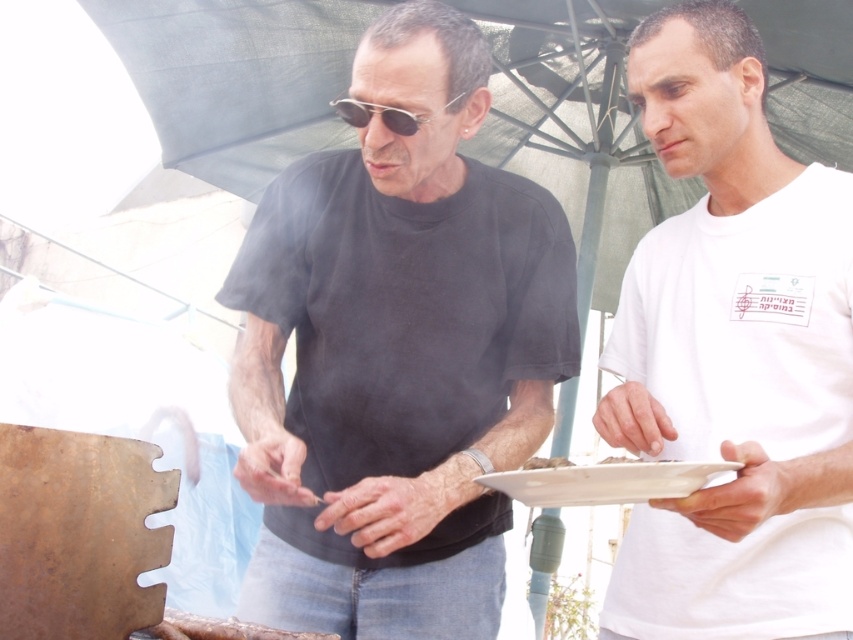
Question: Is white cotton t-shirt at center further to camera compared to sunglasses at center?

Choices:
 (A) no
 (B) yes

Answer: (A)

Question: Does black matte shirt at center appear on the right side of white cotton t-shirt at center?

Choices:
 (A) no
 (B) yes

Answer: (A)

Question: Among these objects, which one is farthest from the camera?

Choices:
 (A) sunglasses at center
 (B) black matte shirt at center
 (C) white cotton t-shirt at center

Answer: (A)

Question: Is black matte shirt at center closer to camera compared to white cotton t-shirt at center?

Choices:
 (A) no
 (B) yes

Answer: (A)

Question: Which is nearer to the black matte shirt at center?

Choices:
 (A) white cotton t-shirt at center
 (B) sunglasses at center

Answer: (A)

Question: Among these objects, which one is farthest from the camera?

Choices:
 (A) sunglasses at center
 (B) black matte shirt at center
 (C) white cotton t-shirt at center

Answer: (A)